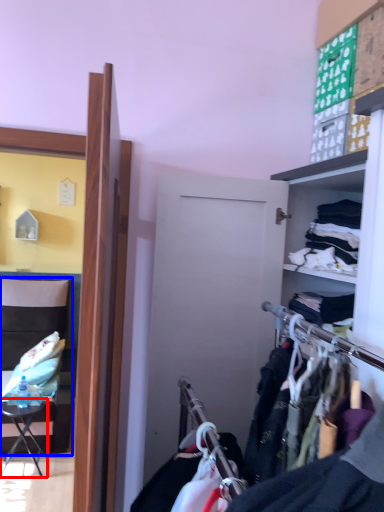
Question: Which object appears closest to the camera in this image, table (highlighted by a red box) or chair (highlighted by a blue box)?

Choices:
 (A) table
 (B) chair

Answer: (A)